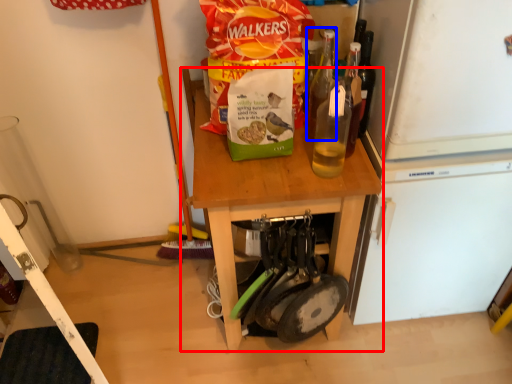
Question: Which object is further to the camera taking this photo, furniture (highlighted by a red box) or bottle (highlighted by a blue box)?

Choices:
 (A) furniture
 (B) bottle

Answer: (A)